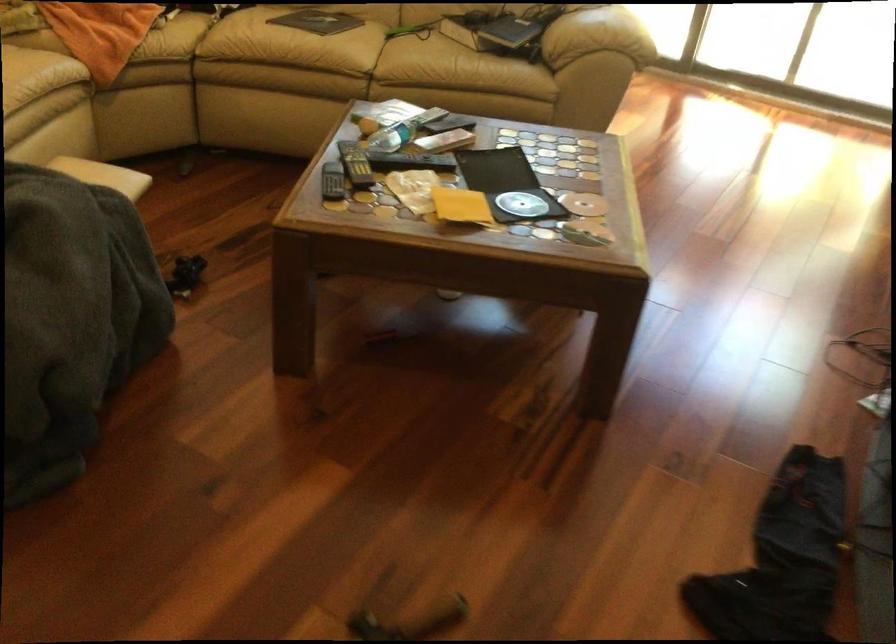
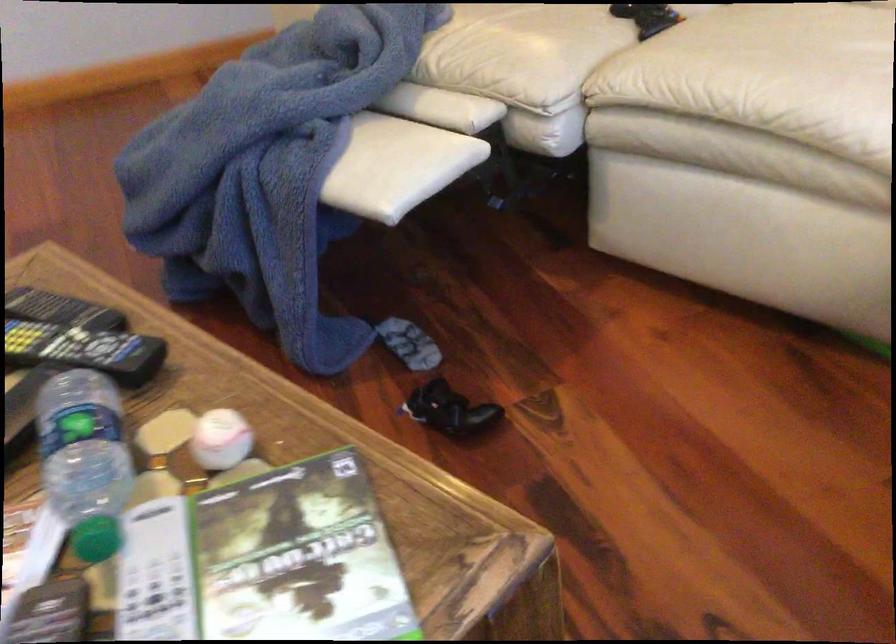
Locate, in the second image, the point that corresponds to (x=365, y=152) in the first image.

(84, 350)